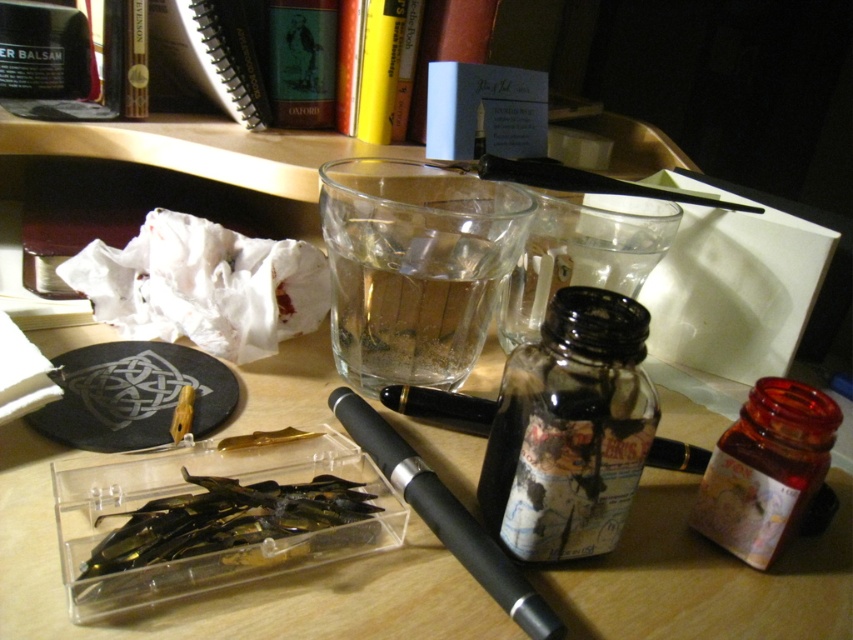
Based on the photo, you have a small decorative box that is exactly the same size as the black rubberized pen at center. Can this box fit inside the transparent plastic container with pens at center without overlapping the edges?

The transparent plastic container with pens at center is wider than the black rubberized pen at center, so the decorative box can fit inside the container without overlapping the edges.

You are organizing your desk and want to place a decorative item on top of the transparent plastic container with pens at center. Can you put the black rubberized pen at center there?

The transparent plastic container with pens at center is positioned under the black rubberized pen at center, so the black rubberized pen at center is already on top of it. You can place another item there if you move the pen first.

You have two pens on your desk, a black rubberized pen at center and a black glossy pen at center. Which pen is bigger in size?

The black rubberized pen at center is larger in size compared to the black glossy pen at center.